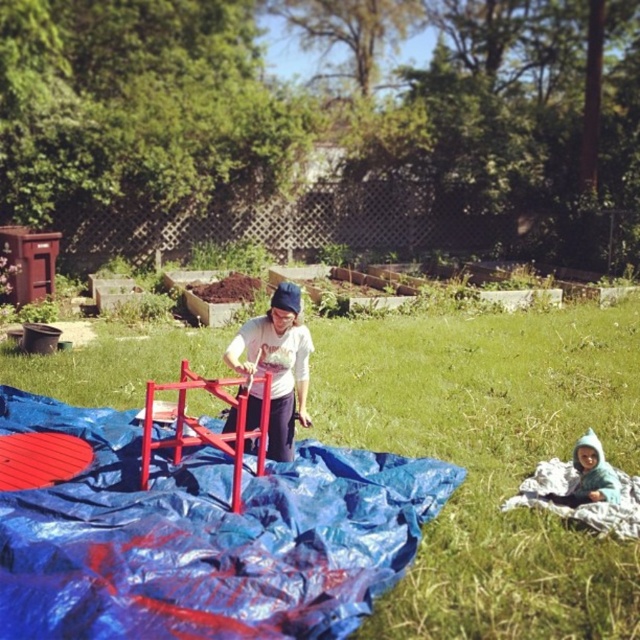
Is green grass at center positioned in front of metallic red ladder at center?

Yes, it is in front of metallic red ladder at center.

Between green grass at center and metallic red ladder at center, which one is positioned lower?

metallic red ladder at center is lower down.

You are a GUI agent. You are given a task and a screenshot of the screen. Output one action in this format:
    pyautogui.click(x=<x>, y=<y>)
    Task: Click on the green grass at center
    This screenshot has height=640, width=640.
    Given the screenshot: What is the action you would take?
    pyautogui.click(x=493, y=460)

Identify the location of green grass at center. (493, 460).

Is green grass at center closer to camera compared to blue fleece jacket at lower right?

Yes, green grass at center is closer to the viewer.

Where is `green grass at center`? green grass at center is located at coordinates (493, 460).

Is point (237, 456) behind point (600, 460)?

No, (237, 456) is closer to viewer.

Is the position of metallic red ladder at center more distant than that of blue fleece jacket at lower right?

That is False.

Which is behind, point (234, 458) or point (616, 486)?

The point (616, 486) is more distant.

At what (x,y) coordinates should I click in order to perform the action: click on metallic red ladder at center. Please return your answer as a coordinate pair (x, y). Looking at the image, I should click on (204, 426).